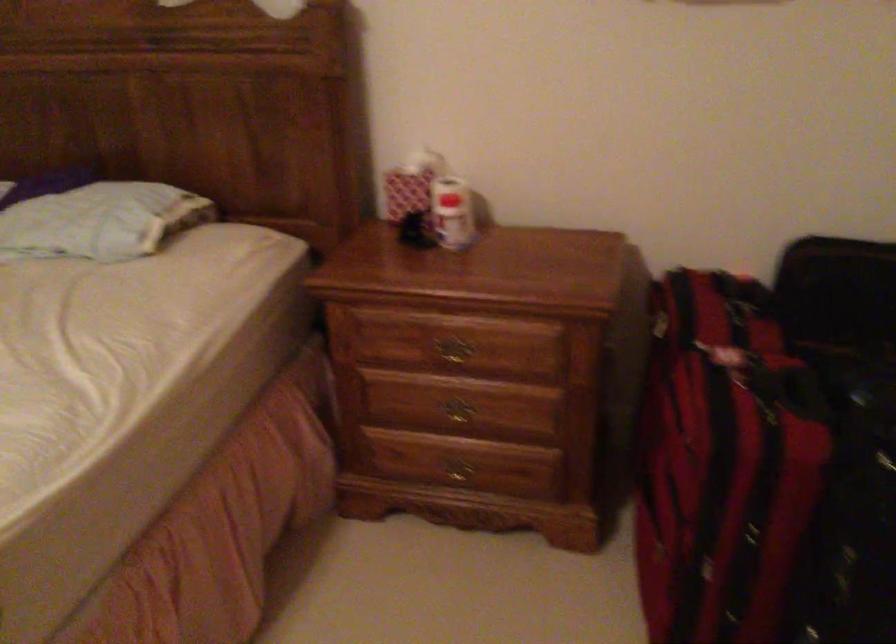
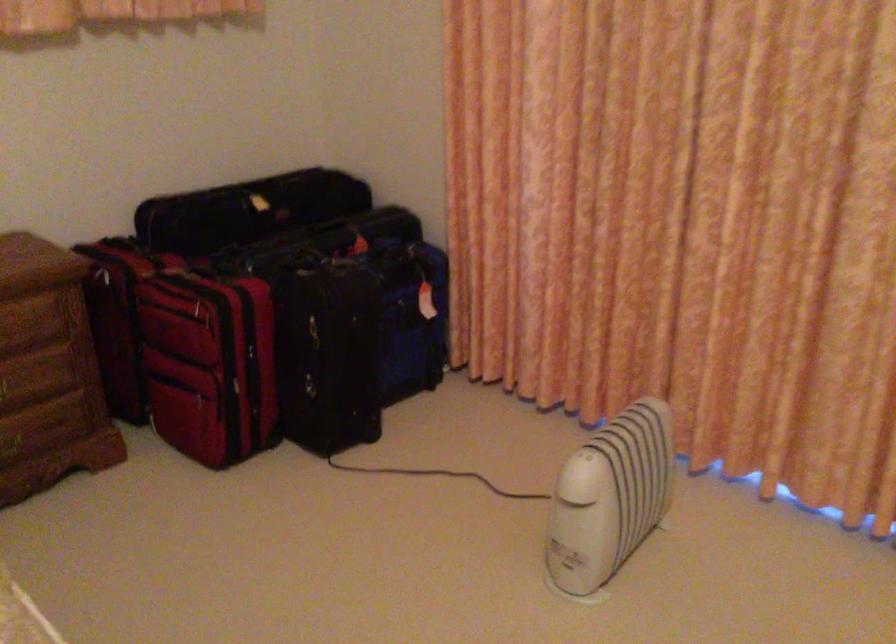
Find the pixel in the second image that matches point 471,422 in the first image.

(18, 391)